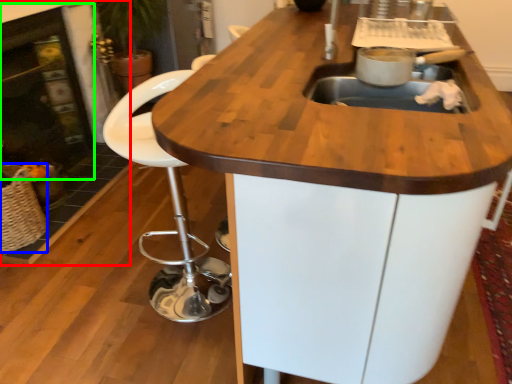
Question: Based on their relative distances, which object is farther from fireplace (highlighted by a red box)? Choose from basket (highlighted by a blue box) and fireplace (highlighted by a green box).

Choices:
 (A) basket
 (B) fireplace

Answer: (A)